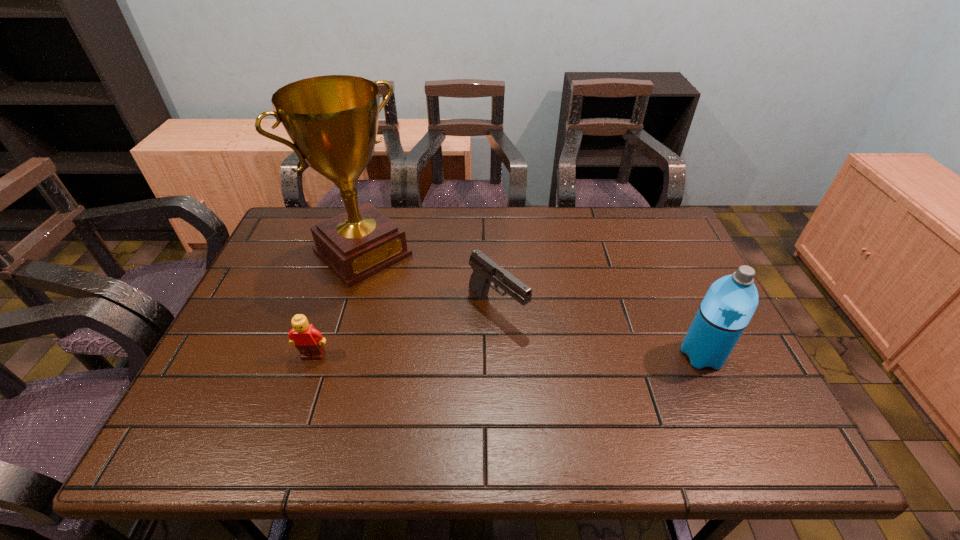
At what (x,y) coordinates should I click in order to perform the action: click on Lego. Please return your answer as a coordinate pair (x, y). The height and width of the screenshot is (540, 960). Looking at the image, I should click on (308, 340).

The image size is (960, 540). I want to click on thermos bottle, so click(728, 306).

The height and width of the screenshot is (540, 960). Identify the location of the rightmost object. (728, 306).

The width and height of the screenshot is (960, 540). In order to click on award in this screenshot , I will do `click(332, 120)`.

Find the location of `the third object from left to right`. the third object from left to right is located at coordinates (485, 270).

Where is `free region located on the face of the Lego`? free region located on the face of the Lego is located at coordinates (295, 410).

Find the location of a particular element. This screenshot has height=540, width=960. free space located 0.290m on the back of the rightmost object is located at coordinates (660, 262).

Find the location of a particular element. The image size is (960, 540). free space located 0.050m on the plaque of the tallest object is located at coordinates (399, 288).

Where is `vacant space located 0.090m on the plaque of the tallest object`? Image resolution: width=960 pixels, height=540 pixels. vacant space located 0.090m on the plaque of the tallest object is located at coordinates (408, 296).

This screenshot has width=960, height=540. Identify the location of free space located 0.050m on the plaque of the tallest object. (399, 288).